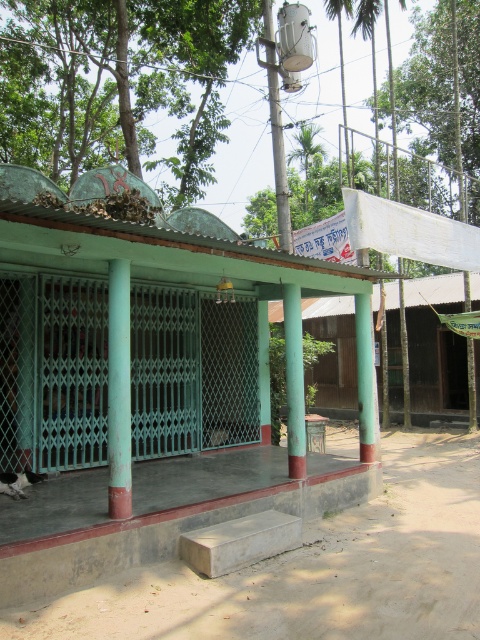
Question: Which point is farther to the camera?

Choices:
 (A) green painted wood hut at center
 (B) green painted metal column at center

Answer: (A)

Question: Where is white fabric canopy at upper center located in relation to green matte column at center in the image?

Choices:
 (A) left
 (B) right

Answer: (B)

Question: Observing the image, what is the correct spatial positioning of green painted metal column at center in reference to green matte column at center?

Choices:
 (A) left
 (B) right

Answer: (A)

Question: Does green painted metal column at center come in front of green matte column at center?

Choices:
 (A) no
 (B) yes

Answer: (B)

Question: Which point is farther from the camera taking this photo?

Choices:
 (A) (119, 429)
 (B) (320, 307)

Answer: (B)

Question: Which object is the farthest from the green painted wood at center?

Choices:
 (A) green matte column at center
 (B) white fabric canopy at upper center

Answer: (B)